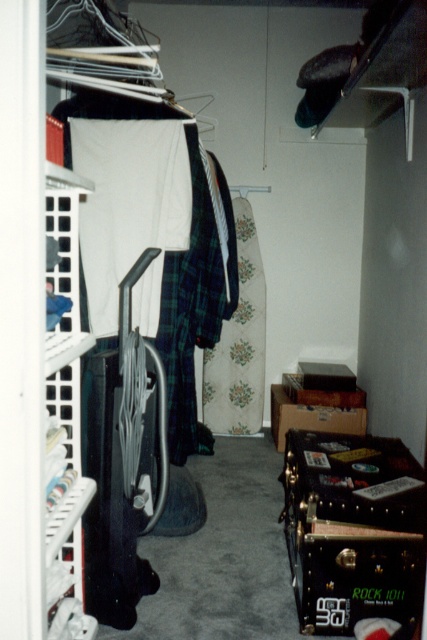
Question: Is white fabric at center further to the viewer compared to floral fabric dress at center?

Choices:
 (A) no
 (B) yes

Answer: (A)

Question: Is white fabric at center to the left of floral fabric dress at center from the viewer's perspective?

Choices:
 (A) no
 (B) yes

Answer: (B)

Question: Among these objects, which one is farthest from the camera?

Choices:
 (A) floral fabric dress at center
 (B) white fabric at center

Answer: (A)

Question: Where is white fabric at center located in relation to floral fabric dress at center in the image?

Choices:
 (A) above
 (B) below

Answer: (A)

Question: Among these points, which one is farthest from the camera?

Choices:
 (A) (87, 211)
 (B) (257, 326)

Answer: (B)